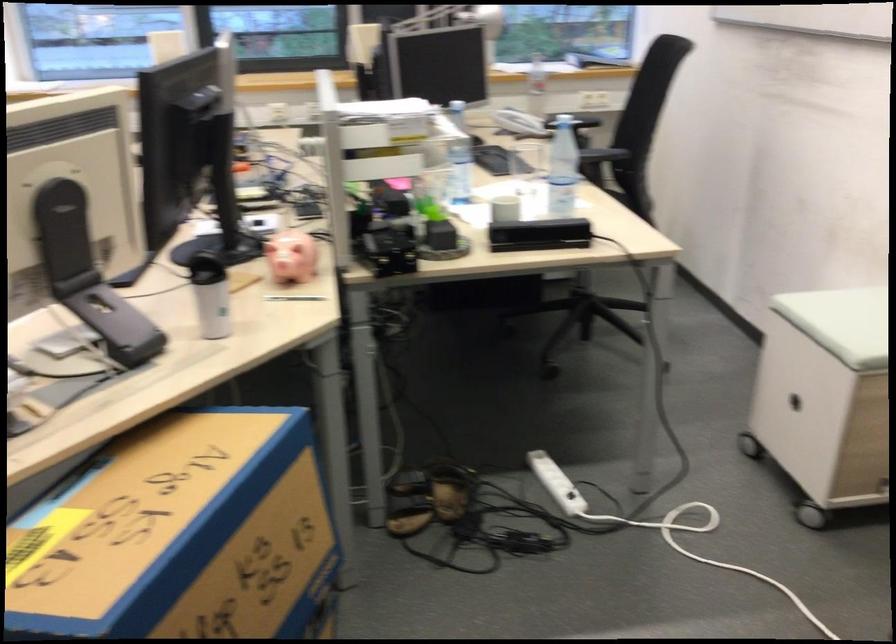
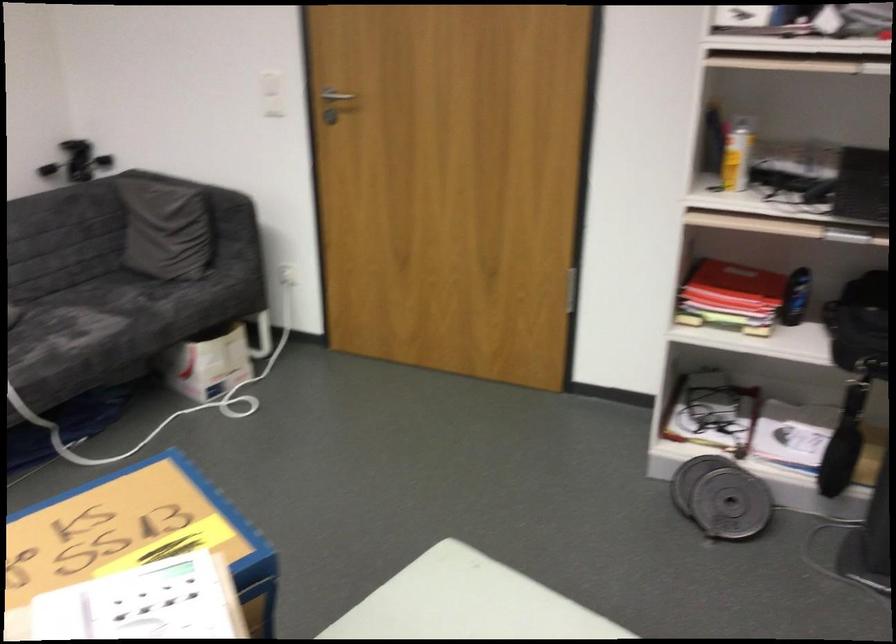
Find the pixel in the second image that matches point 97,562 in the first image.

(139, 535)